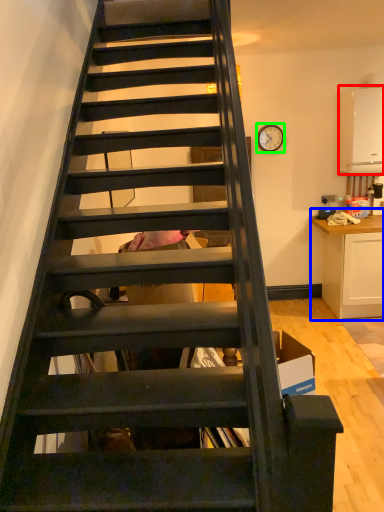
Question: Which object is the closest to the appliance (highlighted by a red box)? Choose among these: cabinetry (highlighted by a blue box) or clock (highlighted by a green box).

Choices:
 (A) cabinetry
 (B) clock

Answer: (B)